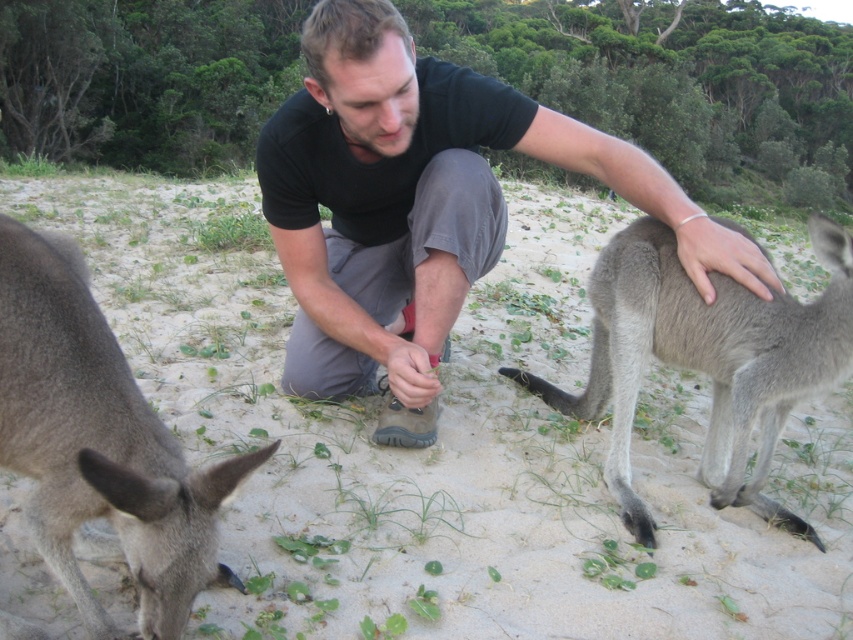
Based on the photo, you are a photographer trying to capture both the black cotton shirt at center and the gray fur kangaroo at lower left in the same frame. Based on their sizes, which object should you focus on first to ensure both fit in the photo?

The black cotton shirt at center is larger than the gray fur kangaroo at lower left, so you should focus on including the black cotton shirt at center first to ensure both fit in the photo.

You are a photographer standing at the edge of the sandy area. You want to take a photo of the black cotton shirt at center without the sandy beige sand at center appearing in the foreground. Is this possible based on their positions?

The sandy beige sand at center is closer to the viewer than the black cotton shirt at center, so it would block the view of the shirt. Therefore, it is not possible to take a photo of the black cotton shirt at center without the sand appearing in the foreground.